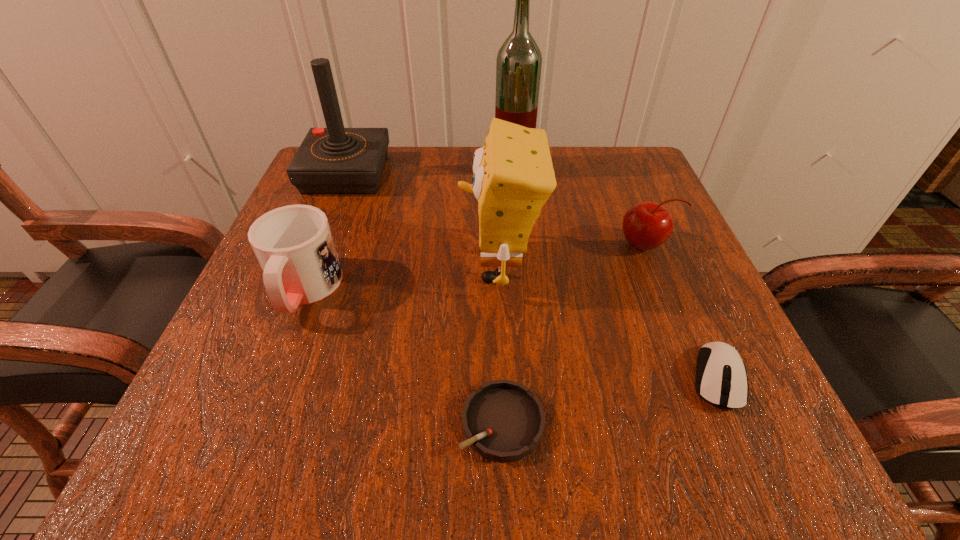
You are a GUI agent. You are given a task and a screenshot of the screen. Output one action in this format:
    pyautogui.click(x=<x>, y=<y>)
    Task: Click on the free space at the far right corner of the desktop
    
    Given the screenshot: What is the action you would take?
    pyautogui.click(x=597, y=166)

Locate an element on the screen. This screenshot has width=960, height=540. vacant space that is in between the mouse and the sponge is located at coordinates (609, 322).

Locate an element on the screen. vacant space that's between the joystick and the mouse is located at coordinates (532, 276).

Locate an element on the screen. blank region between the mouse and the ashtray is located at coordinates (610, 400).

The width and height of the screenshot is (960, 540). Find the location of `free space between the cherry and the liquor`. free space between the cherry and the liquor is located at coordinates (579, 207).

At what (x,y) coordinates should I click in order to perform the action: click on free space that is in between the mouse and the tallest object. Please return your answer as a coordinate pair (x, y). The image size is (960, 540). Looking at the image, I should click on (615, 273).

The image size is (960, 540). In order to click on vacant space that is in between the cherry and the mouse in this screenshot , I will do `click(682, 311)`.

What are the coordinates of `blank region between the sponge and the mug` in the screenshot? It's located at (402, 278).

Where is `object that is the sixth closest to the cherry`? object that is the sixth closest to the cherry is located at coordinates (294, 245).

Choose which object is the fourth nearest neighbor to the tallest object. Please provide its 2D coordinates. Your answer should be formatted as a tuple, i.e. [(x, y)], where the tuple contains the x and y coordinates of a point satisfying the conditions above.

[(294, 245)]